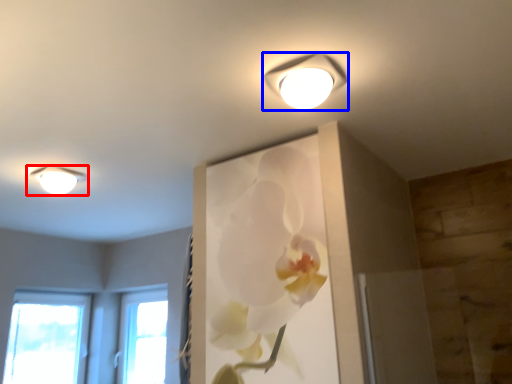
Question: Which object appears closest to the camera in this image, lamp (highlighted by a red box) or lamp (highlighted by a blue box)?

Choices:
 (A) lamp
 (B) lamp

Answer: (B)